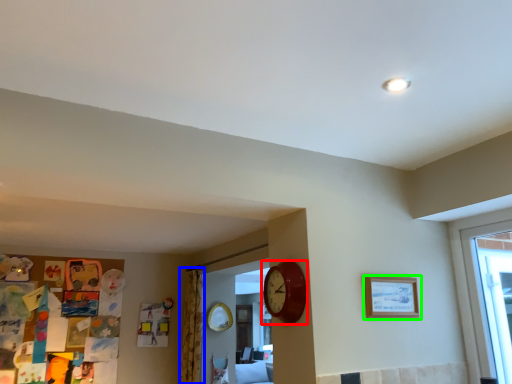
Question: Which object is positioned closest to wall clock (highlighted by a red box)? Select from curtain (highlighted by a blue box) and picture frame (highlighted by a green box).

Choices:
 (A) curtain
 (B) picture frame

Answer: (B)